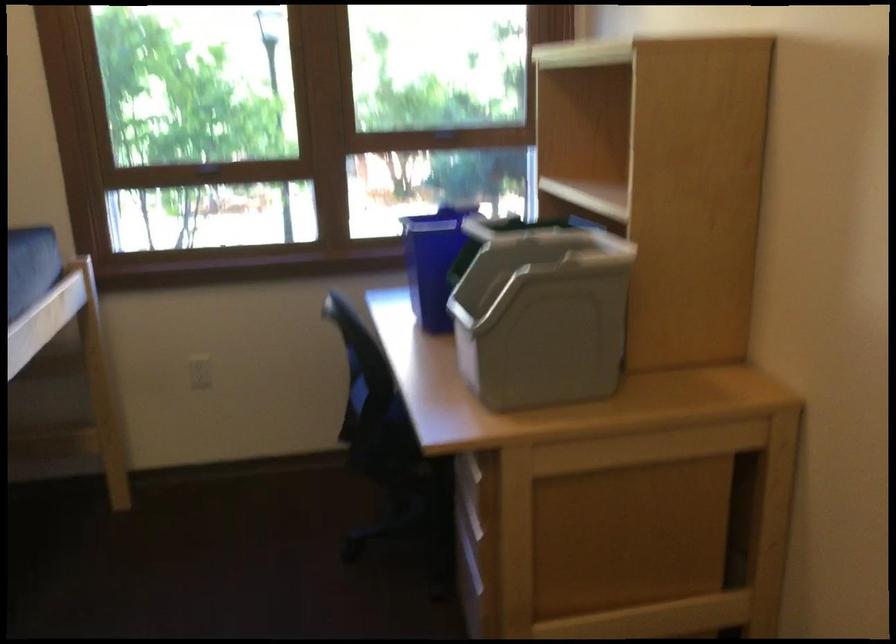
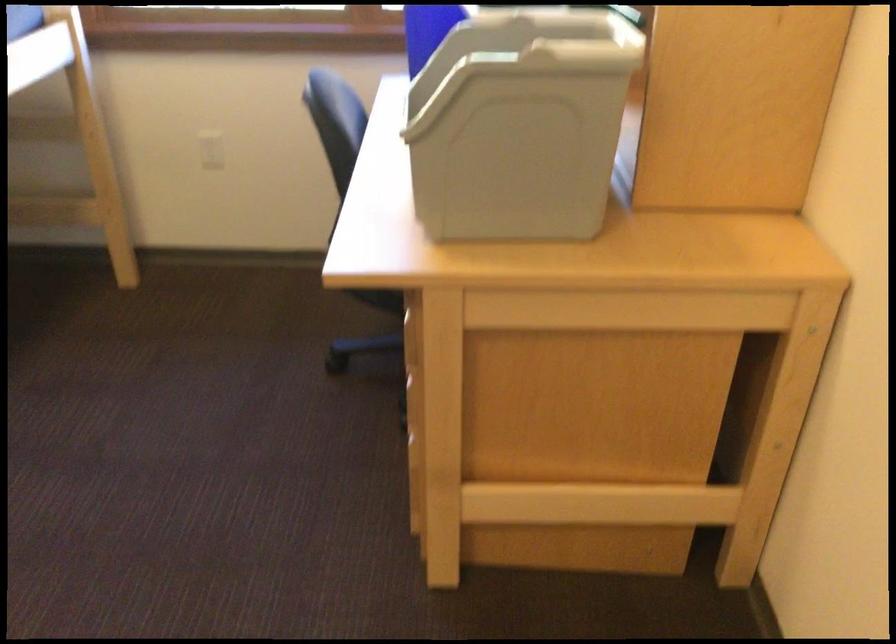
In the second image, find the point that corresponds to point 558,241 in the first image.

(565, 24)